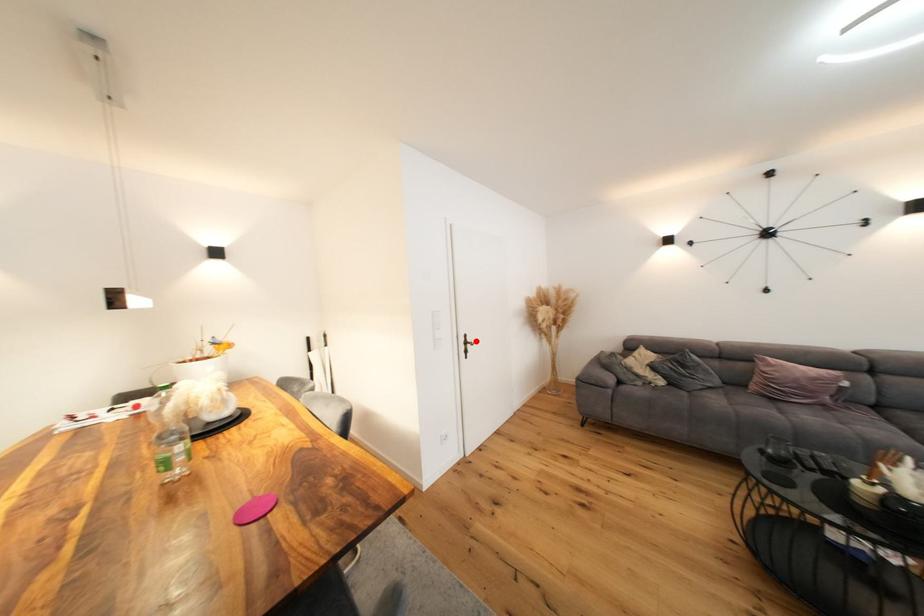
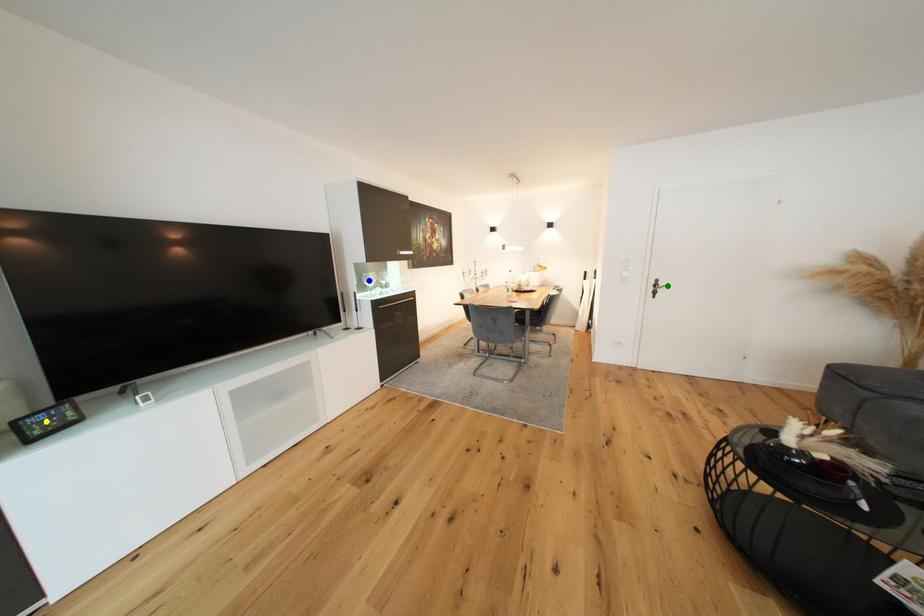
Question: I am providing you with two images of the same scene from different viewpoints. A red point is marked on the first image. You are given multiple points on the second image. In image 2, which mark is for the same physical point as the one in image 1?

Choices:
 (A) yellow point
 (B) green point
 (C) blue point

Answer: (B)